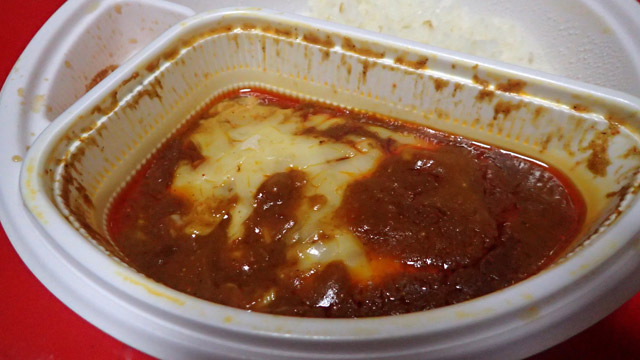
The image size is (640, 360). I want to click on paper plate, so click(x=59, y=28).